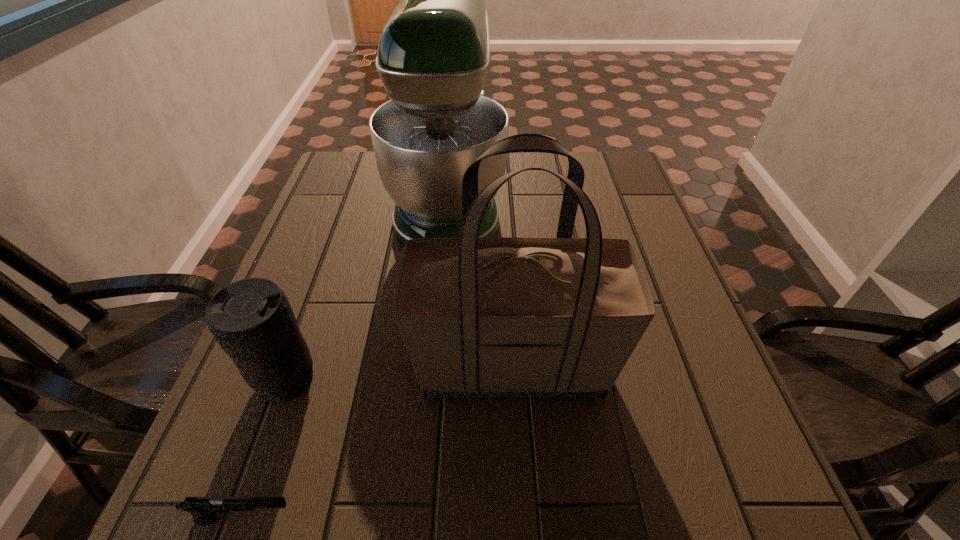
The height and width of the screenshot is (540, 960). Identify the location of vacant region at the far left corner of the desktop. (379, 185).

Locate an element on the screen. Image resolution: width=960 pixels, height=540 pixels. blank space at the near left corner of the desktop is located at coordinates (281, 518).

Identify the location of free space at the far right corner of the desktop. This screenshot has width=960, height=540. (621, 170).

The height and width of the screenshot is (540, 960). Find the location of `vacant point located between the nearest object and the shopping bag`. vacant point located between the nearest object and the shopping bag is located at coordinates (379, 442).

This screenshot has height=540, width=960. Identify the location of vacant area between the farthest object and the shortest object. point(348,360).

Find the location of a particular element. free area in between the second shortest object and the shopping bag is located at coordinates coord(399,373).

Identify the location of vacant space in between the farthest object and the shortest object. The image size is (960, 540). (348, 360).

Find the location of a particular element. blank region between the telephoto lens and the farthest object is located at coordinates (368, 290).

Image resolution: width=960 pixels, height=540 pixels. Find the location of `free space between the shopping bag and the gun`. free space between the shopping bag and the gun is located at coordinates (379, 442).

Find the location of `blank region between the gun and the mixer`. blank region between the gun and the mixer is located at coordinates (348, 360).